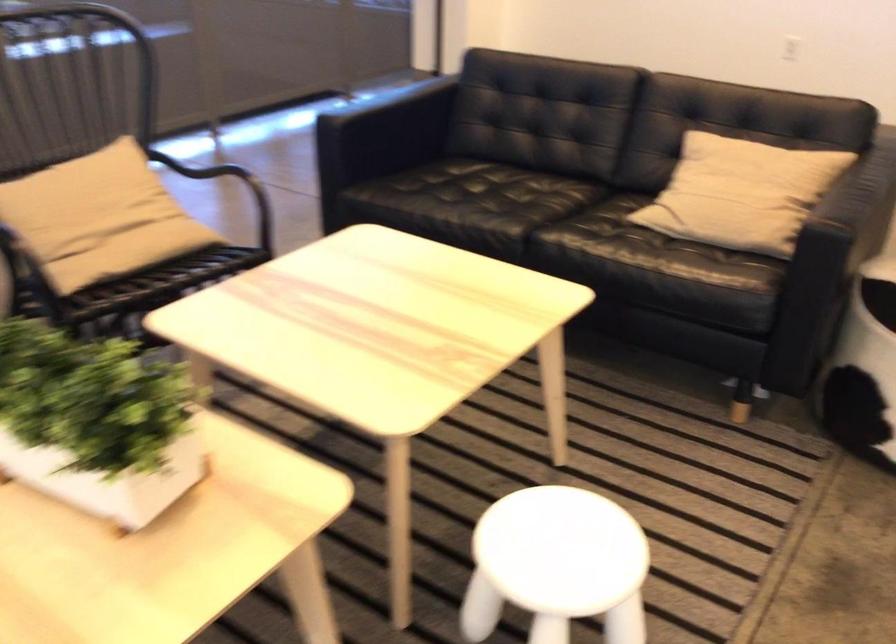
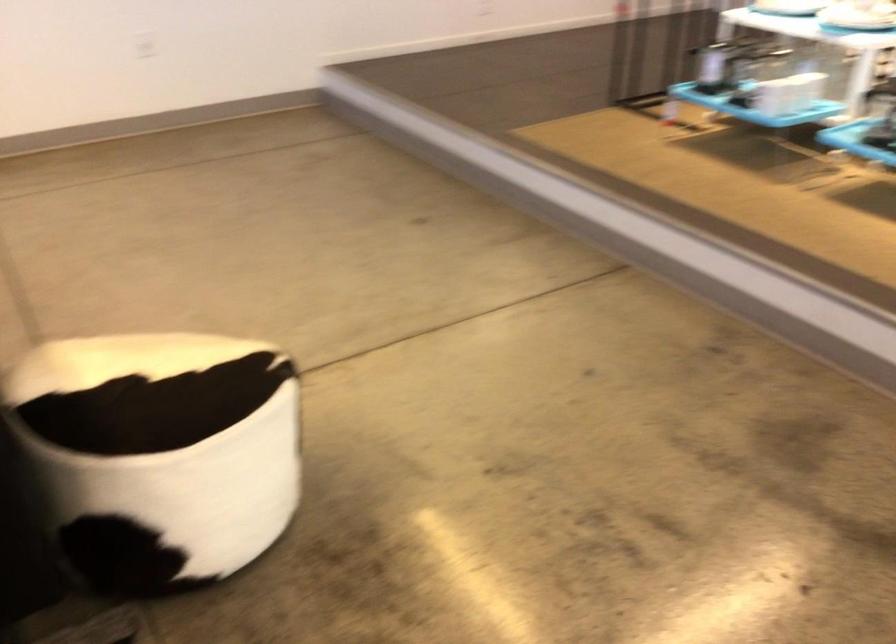
Question: How did the camera likely rotate?

Choices:
 (A) Left
 (B) Right
 (C) Up
 (D) Down

Answer: (B)